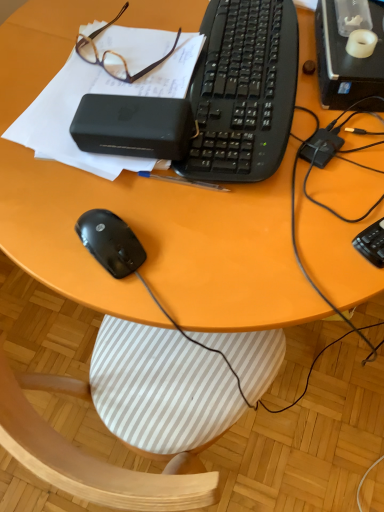
Where is `vacant space that's between black matte mouse at lower left and black plastic power bank at upper center`? The image size is (384, 512). vacant space that's between black matte mouse at lower left and black plastic power bank at upper center is located at coordinates pos(130,200).